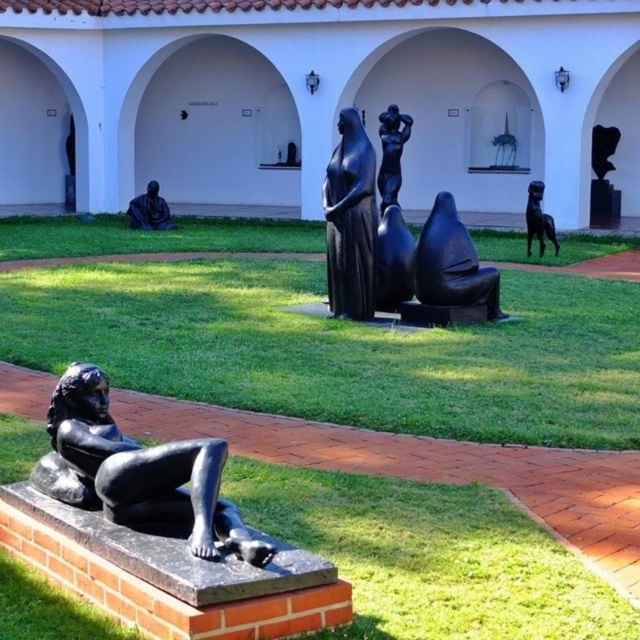
You are an art student standing in the sculpture garden and want to take a photo of both the black polished statue at lower left and the polished bronze statue at center. Since you can only focus on one statue at a time, which statue should you focus on first to ensure it appears sharp in your photo?

You should focus on the black polished statue at lower left first because it is closer to the viewer than the polished bronze statue at center. By focusing on the closer statue, you can ensure it will be sharp, and the farther one may still be in focus depending on your camera settings.

You are a tour guide leading a group through the sculpture garden. You want to point out the black polished statue at lower left and the polished bronze statue at center to your group. Can you tell them how far apart these two statues are?

The black polished statue at lower left is 43.80 feet from the polished bronze statue at center.

You are standing in the sculpture garden and want to know how far the point at coordinates (104, 472) is from you. Can you determine the distance?

The point at coordinates (104, 472) is 5.68 meters from the viewer.